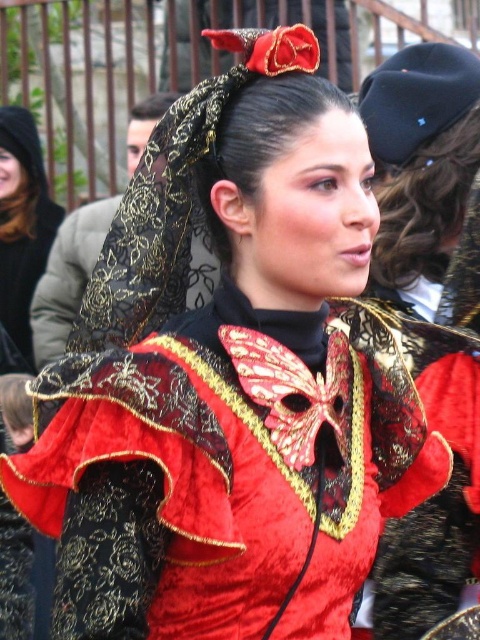
You are a photographer setting up for a cultural event. You notice two veils on the participant wearing the traditional attire. The veils are the black lace veil at upper center and the matte black veil at upper left. From your perspective, which veil is closer to you?

The black lace veil at upper center is closer to you because it is in front of the matte black veil at upper left.